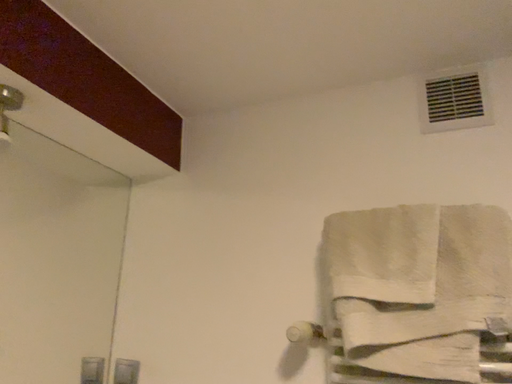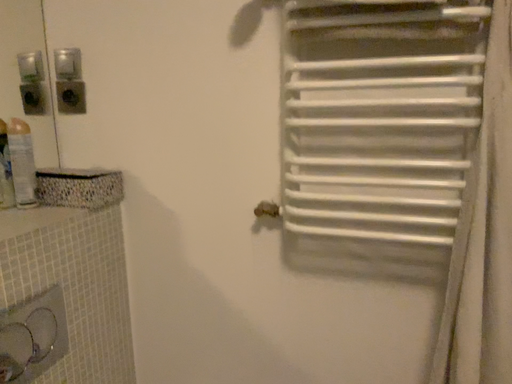
Question: Which way did the camera rotate in the video?

Choices:
 (A) rotated downward
 (B) rotated upward

Answer: (A)